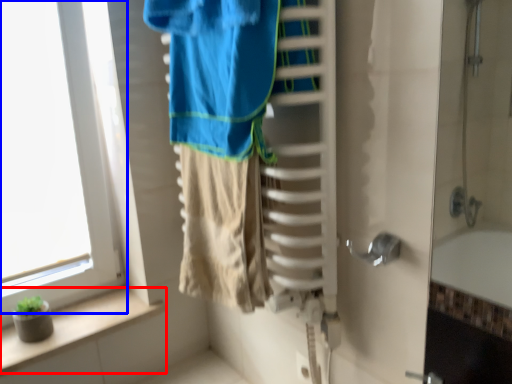
Question: Which object appears farthest to the camera in this image, balustrade (highlighted by a red box) or window (highlighted by a blue box)?

Choices:
 (A) balustrade
 (B) window

Answer: (A)